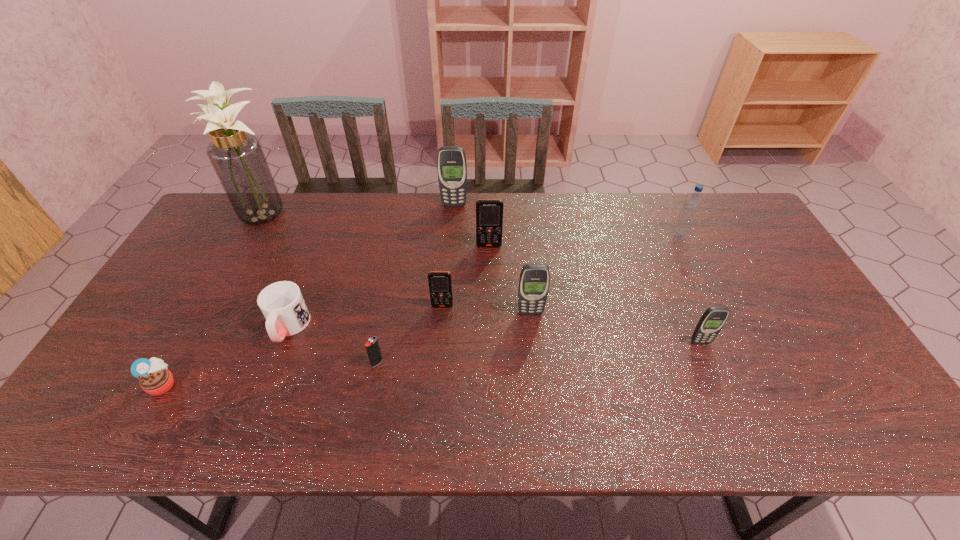
Select which object is the fourth closest to the third object from right to left. Please provide its 2D coordinates. Your answer should be formatted as a tuple, i.e. [(x, y)], where the tuple contains the x and y coordinates of a point satisfying the conditions above.

[(712, 321)]

The height and width of the screenshot is (540, 960). In order to click on the fourth closest object to the nearer orange cellular telephone in this screenshot , I will do [282, 304].

Find the location of a particular element. This screenshot has height=540, width=960. cellular telephone that can be found as the second closest to the farthest gray cellular telephone is located at coordinates (440, 283).

Locate an element on the screen. cellular telephone that stands as the third closest to the nearest cellular telephone is located at coordinates (440, 283).

The image size is (960, 540). What are the coordinates of `gray cellular telephone that is the second closest one to the ninth object from left to right` in the screenshot? It's located at (451, 163).

The width and height of the screenshot is (960, 540). What are the coordinates of `gray cellular telephone object that ranks as the third closest to the third object from left to right` in the screenshot? It's located at (712, 321).

Locate an element on the screen. Image resolution: width=960 pixels, height=540 pixels. vacant point that satisfies the following two spatial constraints: 1. on the side of the second nearest object with the handle; 2. on the right side of the mug is located at coordinates (275, 363).

The width and height of the screenshot is (960, 540). Identify the location of free space in the image that satisfies the following two spatial constraints: 1. on the screen of the nearest cellular telephone; 2. on the front-facing side of the muffin. (718, 384).

The image size is (960, 540). Find the location of `blank area in the image that satisfies the following two spatial constraints: 1. on the side of the mug with the handle; 2. on the left side of the igniter`. blank area in the image that satisfies the following two spatial constraints: 1. on the side of the mug with the handle; 2. on the left side of the igniter is located at coordinates (275, 363).

At what (x,y) coordinates should I click in order to perform the action: click on blank area in the image that satisfies the following two spatial constraints: 1. on the side of the mug with the handle; 2. on the front-facing side of the muffin. Please return your answer as a coordinate pair (x, y). Image resolution: width=960 pixels, height=540 pixels. Looking at the image, I should click on (267, 384).